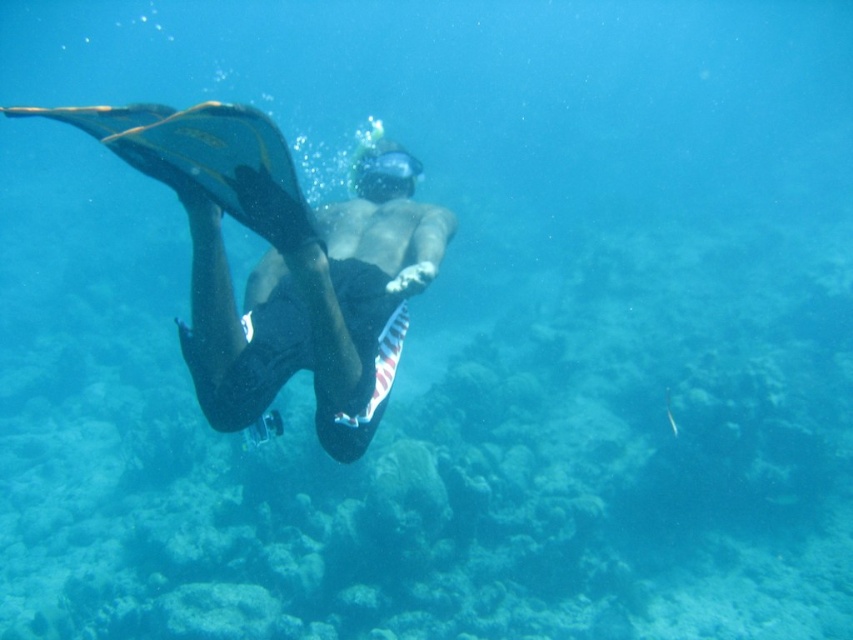
Based on the photo, you are a snorkeler who wants to ensure your gear fits properly. Looking at the image, which object has a greater width between the black matte shorts at center and the transparent rubber goggles at center?

The black matte shorts at center has a greater width than the transparent rubber goggles at center.

You are a snorkeler observing the underwater scene. You notice the black matte shorts at center and the transparent rubber goggles at center. Which object is positioned higher in the water?

The black matte shorts at center is taller than transparent rubber goggles at center, so the black matte shorts at center is positioned higher in the water.

You are a snorkeler trying to adjust your gear. You need to reach your transparent rubber goggles at center while holding onto your black matte shorts at center. Which direction should you move your hand to grab the goggles?

The transparent rubber goggles at center are to the right of the black matte shorts at center. So you should move your hand to the right to grab the transparent rubber goggles at center.